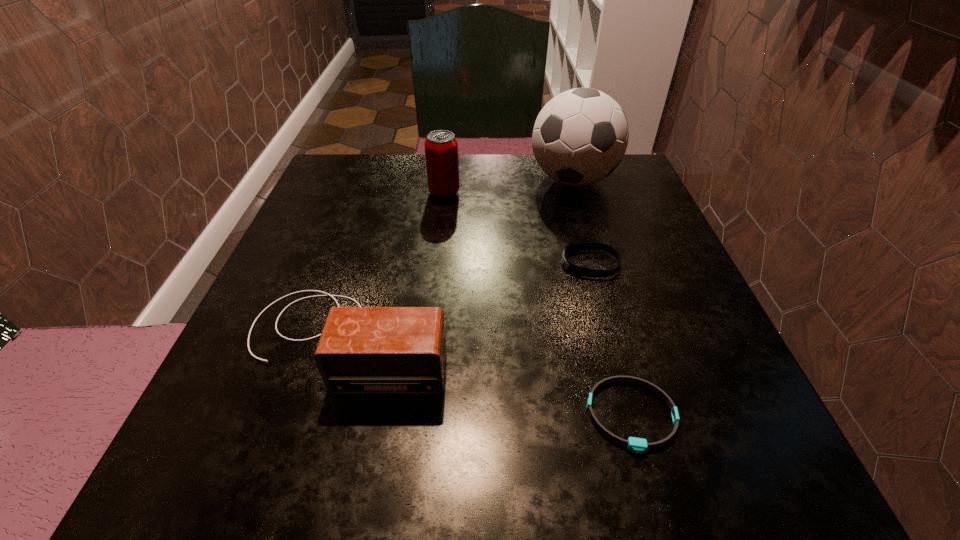
This screenshot has height=540, width=960. I want to click on free space between the third shortest object and the tallest object, so click(x=460, y=259).

Locate an element on the screen. This screenshot has width=960, height=540. vacant area between the farther wristband and the radio receiver is located at coordinates (468, 301).

Find the location of `vacant space in between the radio receiver and the can`. vacant space in between the radio receiver and the can is located at coordinates (396, 266).

Identify the location of free spot between the fourth tallest object and the soccer ball. (582, 222).

Locate an element on the screen. The image size is (960, 540). vacant area between the can and the tallest object is located at coordinates (509, 186).

Find the location of a particular element. The height and width of the screenshot is (540, 960). free space between the radio receiver and the fourth tallest object is located at coordinates (468, 301).

Choose which object is the third nearest neighbor to the shortest object. Please provide its 2D coordinates. Your answer should be formatted as a tuple, i.e. [(x, y)], where the tuple contains the x and y coordinates of a point satisfying the conditions above.

[(580, 136)]

Locate which object ranks second in proximity to the can. Please provide its 2D coordinates. Your answer should be formatted as a tuple, i.e. [(x, y)], where the tuple contains the x and y coordinates of a point satisfying the conditions above.

[(573, 269)]

This screenshot has width=960, height=540. Identify the location of free region that satisfies the following two spatial constraints: 1. on the display of the second shortest object; 2. on the front-facing side of the third tallest object. (611, 339).